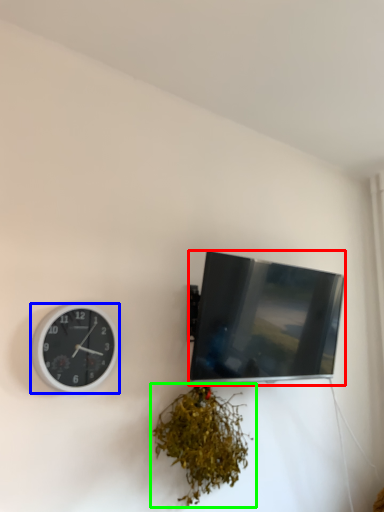
Question: Which object is positioned closest to television (highlighted by a red box)? Select from wall clock (highlighted by a blue box) and houseplant (highlighted by a green box).

Choices:
 (A) wall clock
 (B) houseplant

Answer: (B)